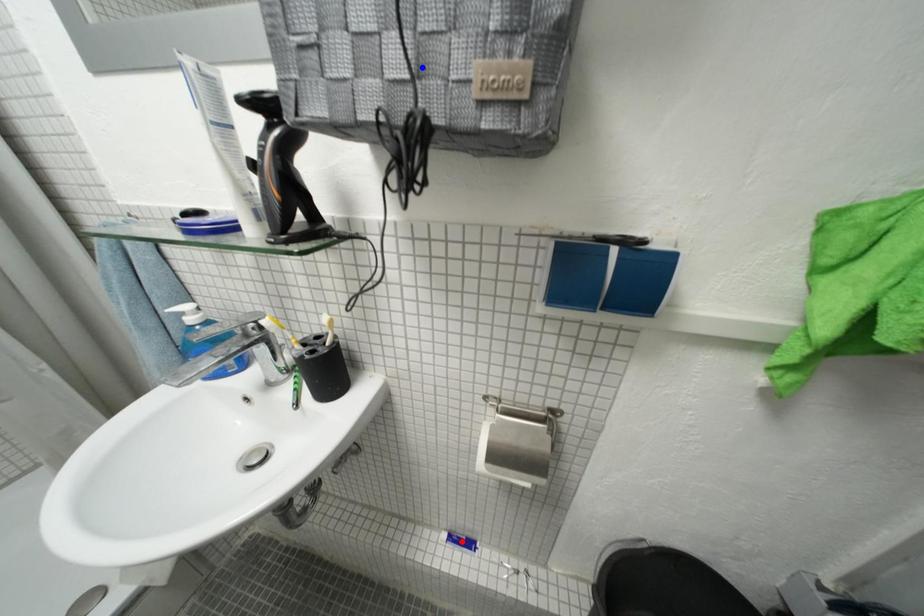
Question: In the image, two points are highlighted. Which point is nearer to the camera? Reply with the corresponding letter.

Choices:
 (A) blue point
 (B) red point

Answer: (A)